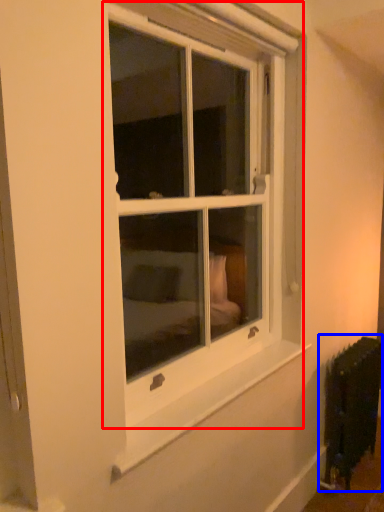
Question: Which object is further to the camera taking this photo, window (highlighted by a red box) or radiator (highlighted by a blue box)?

Choices:
 (A) window
 (B) radiator

Answer: (B)